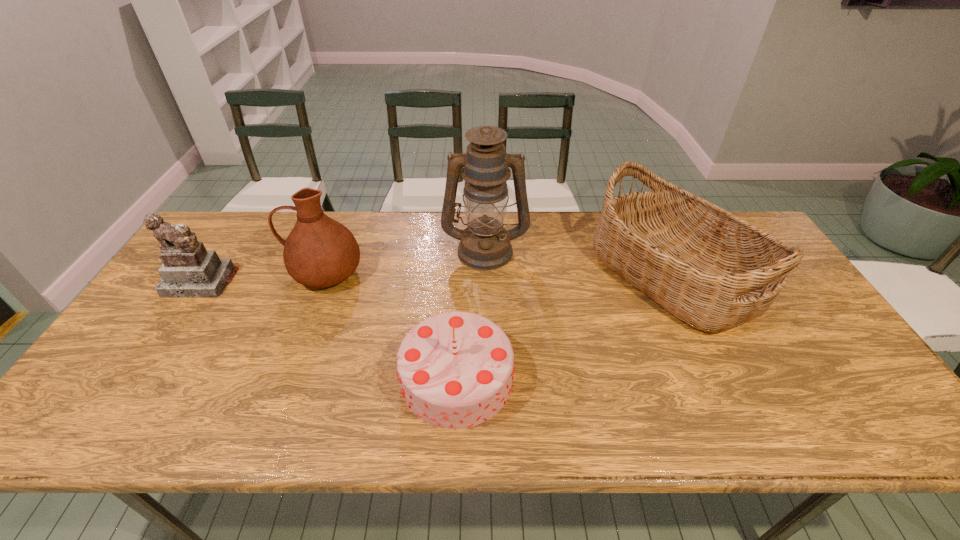
This screenshot has width=960, height=540. What are the coordinates of `oil lamp` in the screenshot? It's located at (484, 245).

This screenshot has width=960, height=540. Identify the location of pitcher. pyautogui.click(x=319, y=252).

Where is `the rightmost object`? Image resolution: width=960 pixels, height=540 pixels. the rightmost object is located at coordinates (714, 271).

The image size is (960, 540). I want to click on the leftmost object, so click(x=189, y=270).

Identify the location of the shortest object. (455, 369).

Where is `free space located 0.130m on the left of the oil lamp`? Image resolution: width=960 pixels, height=540 pixels. free space located 0.130m on the left of the oil lamp is located at coordinates (402, 250).

The image size is (960, 540). In order to click on free space located 0.290m on the side of the pitcher with the handle in this screenshot , I will do `click(191, 273)`.

The image size is (960, 540). Identify the location of blank space located on the side of the pitcher with the handle. (252, 273).

The height and width of the screenshot is (540, 960). I want to click on blank space located 0.300m on the side of the pitcher with the handle, so click(187, 273).

Locate an element on the screen. This screenshot has width=960, height=540. free space located 0.250m on the front of the rightmost object is located at coordinates (746, 432).